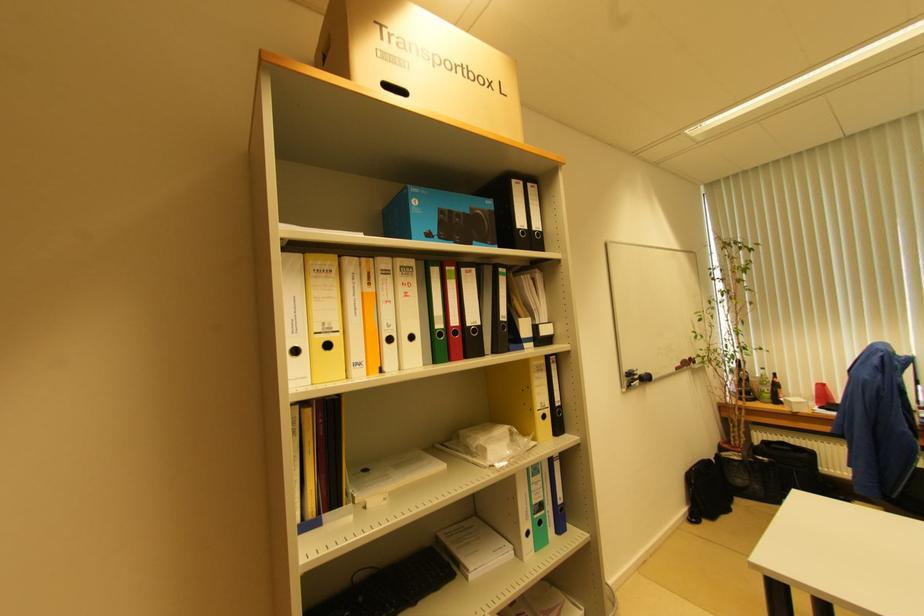
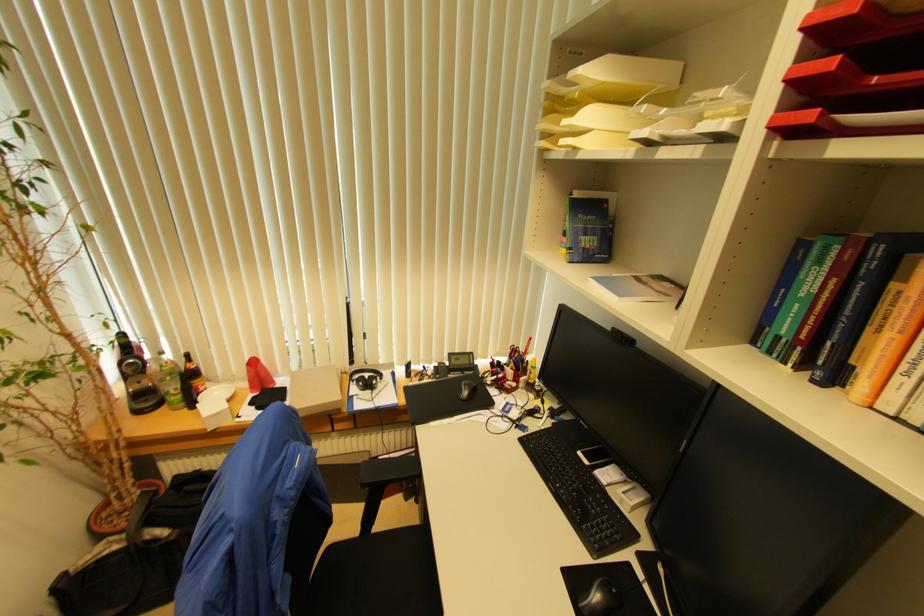
Where in the second image is the point corresponding to (x=767, y=394) from the first image?

(174, 394)